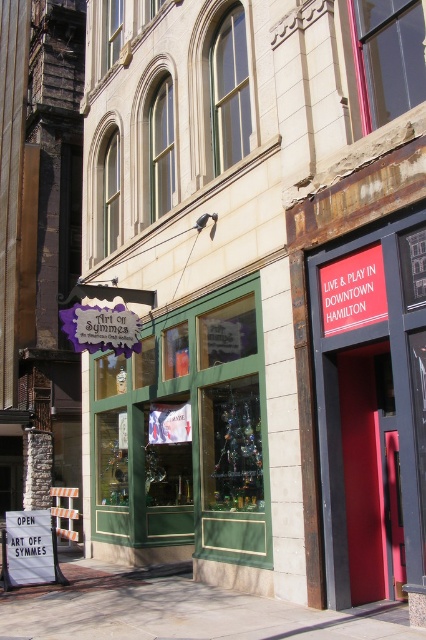
Based on the photo, you are a delivery person who needs to enter the red matte door at center. You notice a white paper sign at lower left nearby. Which object is taller?

The red matte door at center is taller than the white paper sign at lower left.

Based on the photo, you are standing in front of the building in the image. There are two points marked on the building wall. The first point is at coordinates point (360, 275) and the second is at point (65, 595). Which point would appear larger to you?

Point (360, 275) is closer to the camera than point (65, 595). Since objects closer to the camera appear larger, the first point would appear larger.